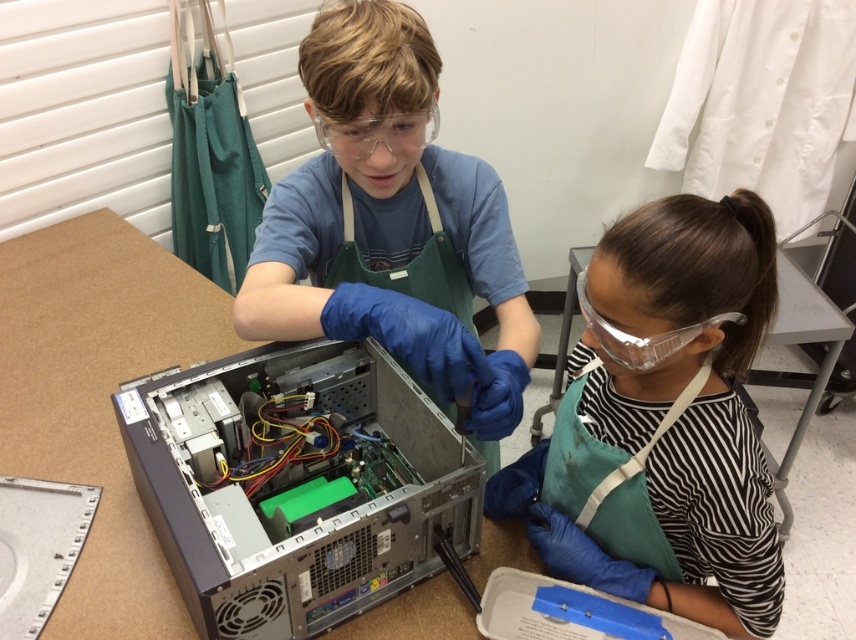
You are an observer in the workshop. You see the green apron at lower right and the clear plastic goggles at center. Which object is higher up in the image?

The green apron at lower right is taller than the clear plastic goggles at center, so the green apron at lower right is higher up in the image.

You are an assistant in a workshop and need to place a box that is 1 meter wide on the table. The table has the silver metallic computer case at center and the clear plastic goggles at upper center already placed. Can the box fit next to the computer case without overlapping the goggles?

The silver metallic computer case at center is wider than the clear plastic goggles at upper center. Since the box is 1 meter wide, it depends on the total space available between the computer case and the goggles. However, since the computer case is wider, placing the box next to it might require more space. Without exact measurements, it is uncertain if it will fit without overlapping the goggles.